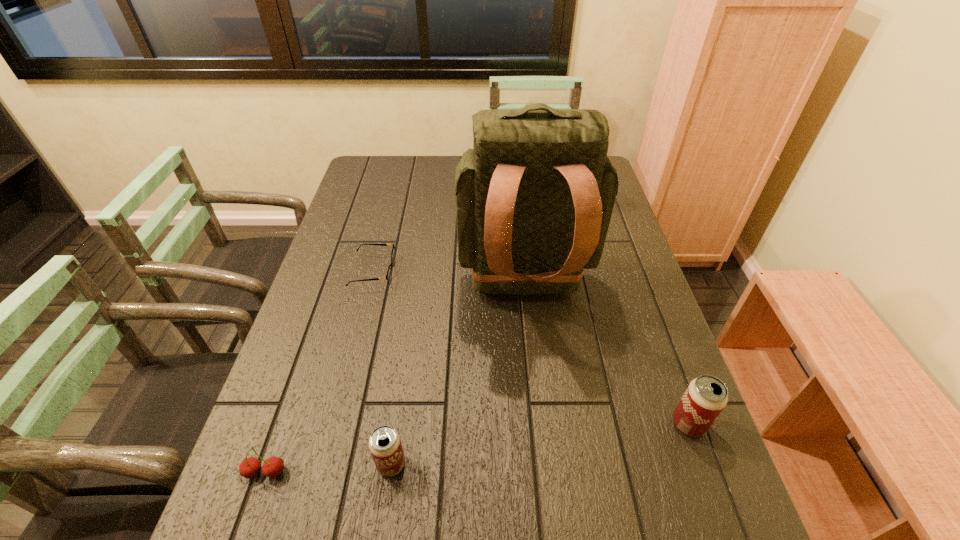
Find the location of a particular element. vacant space that satisfies the following two spatial constraints: 1. on the front-facing side of the third object from right to left; 2. on the right side of the shortest object is located at coordinates (324, 464).